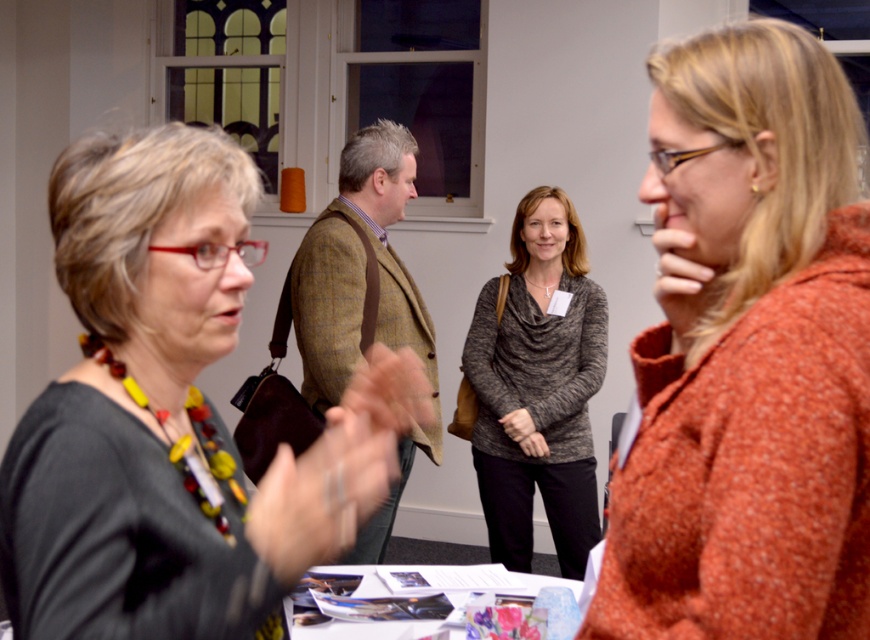
Based on the scene description, which object is taller between the matte black sweater at center and the white paper at center?

The matte black sweater at center is taller than the white paper at center.

You are standing in the room and want to hand a document to the person wearing the orange speckled sweater at right and the matte black sweater at center. Which one can you reach without moving closer?

The orange speckled sweater at right is closer to the viewer than the matte black sweater at center, so you can reach the person wearing the orange speckled sweater at right without moving closer.